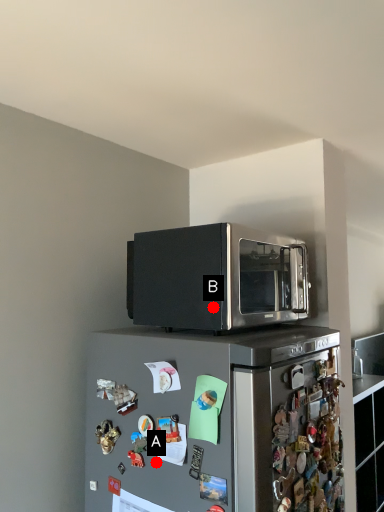
Question: Two points are circled on the image, labeled by A and B beside each circle. Which point is closer to the camera taking this photo?

Choices:
 (A) A is closer
 (B) B is closer

Answer: (B)